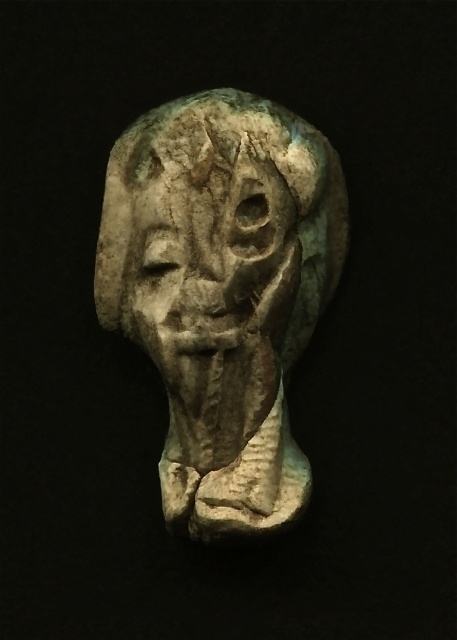
Question: Is gray stone head at center to the left of gray stone face at center from the viewer's perspective?

Choices:
 (A) no
 (B) yes

Answer: (A)

Question: Which point is closer to the camera?

Choices:
 (A) (177, 282)
 (B) (223, 224)

Answer: (B)

Question: Observing the image, what is the correct spatial positioning of gray stone head at center in reference to gray stone face at center?

Choices:
 (A) above
 (B) below

Answer: (B)

Question: Among these objects, which one is farthest from the camera?

Choices:
 (A) gray stone face at center
 (B) gray stone head at center

Answer: (B)

Question: Can you confirm if gray stone head at center is positioned below gray stone face at center?

Choices:
 (A) no
 (B) yes

Answer: (B)